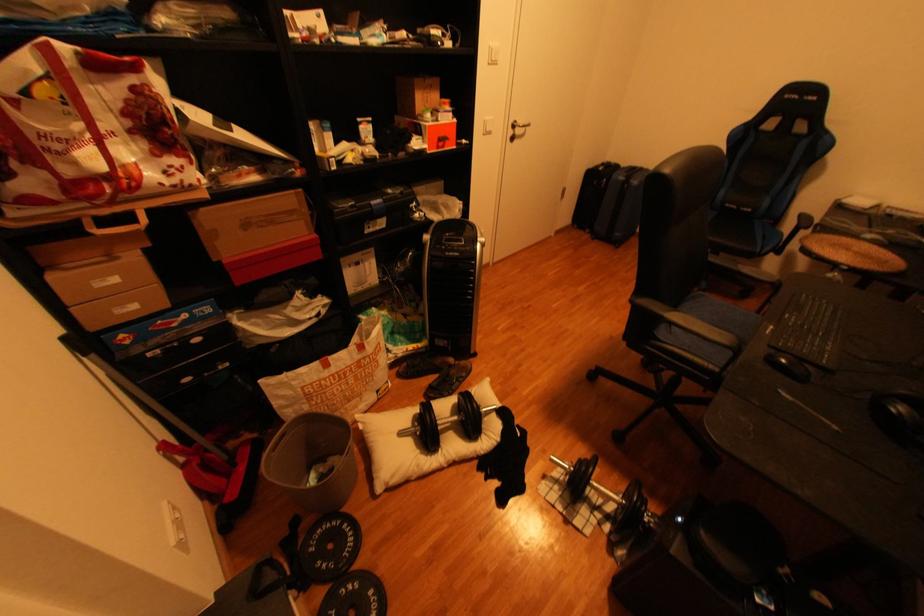
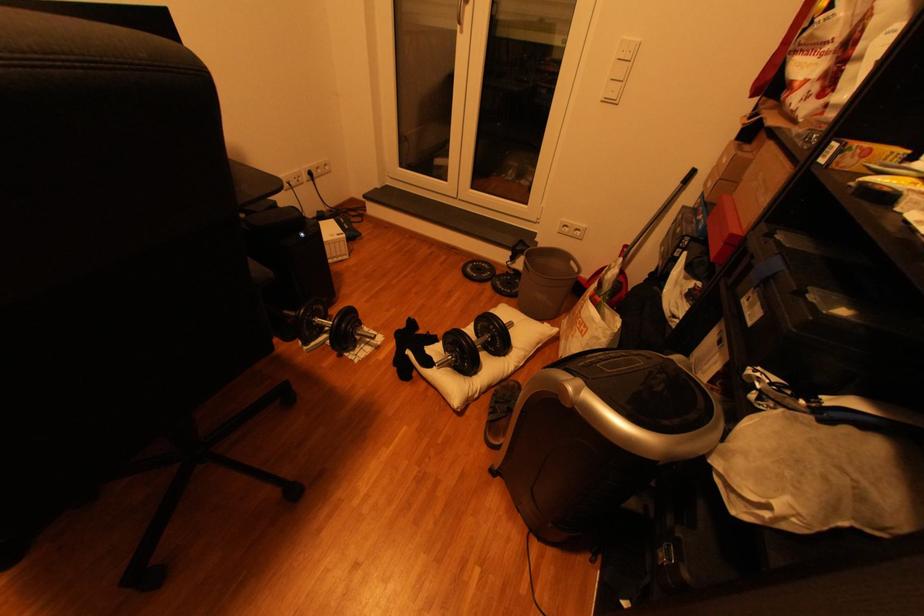
Find the pixel in the second image that matches [464,385] in the first image.

(505, 402)